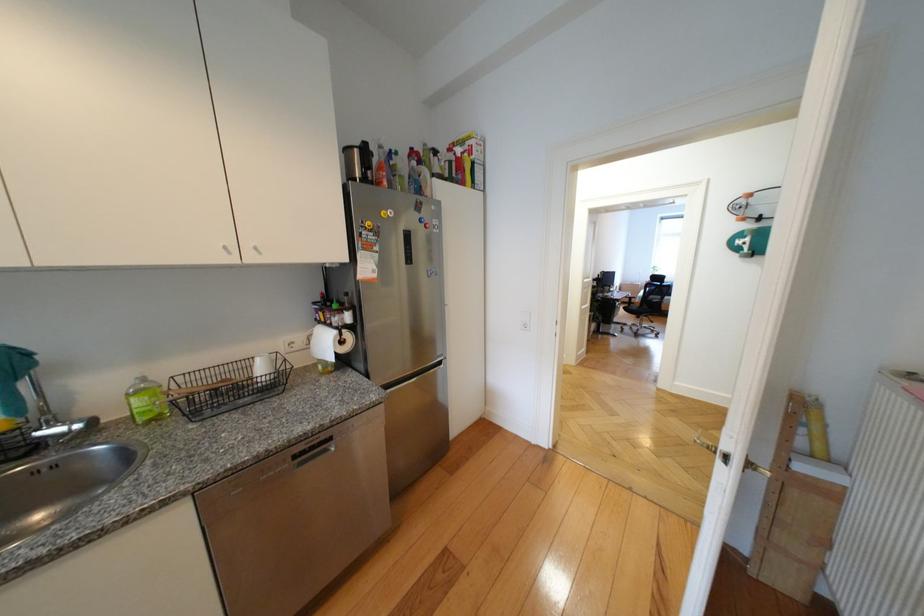
Locate an element on the screen. This screenshot has height=616, width=924. faucet handle is located at coordinates (79, 428).